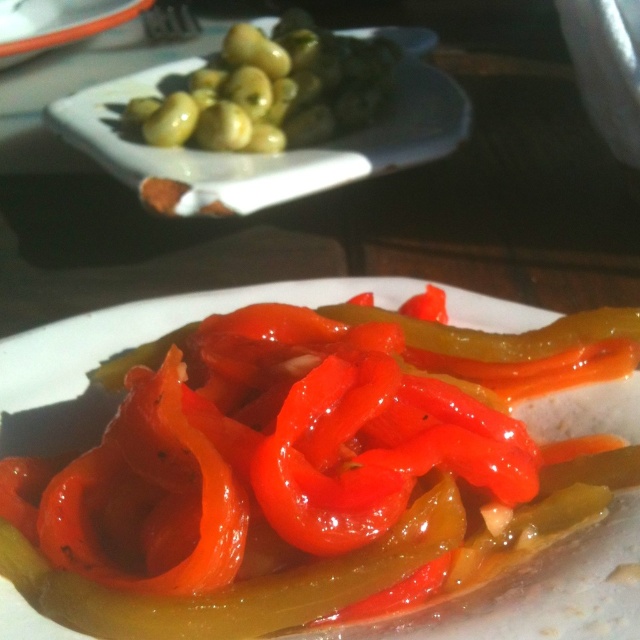
Based on the photo, you are a food stylist arranging a photo shoot. You have two items to place in the scene described. The glossy red pepper at center and the green glossy olives at upper left. Which item should you choose if you want to place a larger object in the composition?

The glossy red pepper at center has a larger size compared to the green glossy olives at upper left, so you should choose the glossy red pepper at center for placing a larger object in the composition.